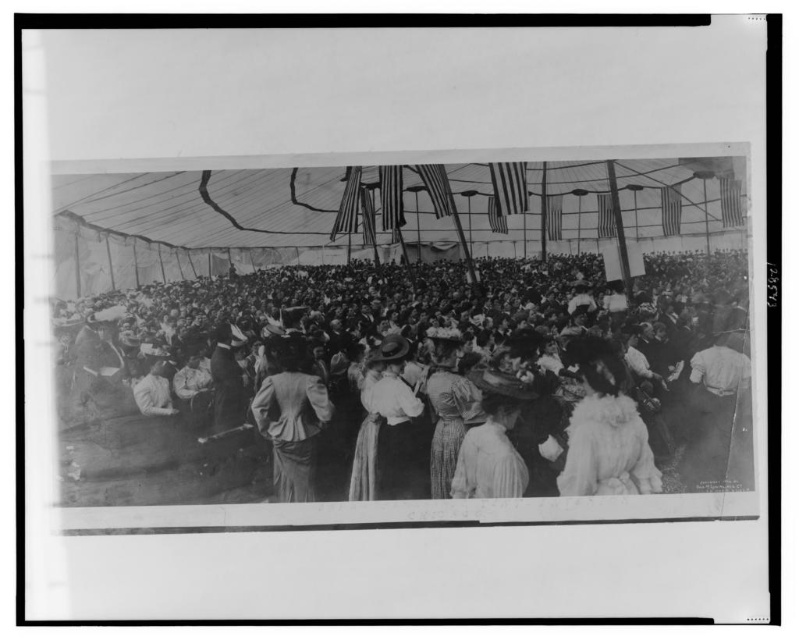
Question: Which point is closer to the camera?

Choices:
 (A) fuzzy white coat at center
 (B) matte black dress at center

Answer: (A)

Question: Which object appears farthest from the camera in this image?

Choices:
 (A) patterned fabric dress at center
 (B) white cotton dresses at center
 (C) light pink fabric dress at center

Answer: (A)

Question: Which point is closer to the camera?

Choices:
 (A) (495, 440)
 (B) (404, 483)

Answer: (A)

Question: Is fuzzy white coat at center closer to the viewer compared to matte black dress at center?

Choices:
 (A) yes
 (B) no

Answer: (A)

Question: Is the position of white cotton dresses at center less distant than that of fuzzy white coat at center?

Choices:
 (A) yes
 (B) no

Answer: (A)

Question: Is white cotton dress at center to the left of matte black dress at center from the viewer's perspective?

Choices:
 (A) yes
 (B) no

Answer: (B)